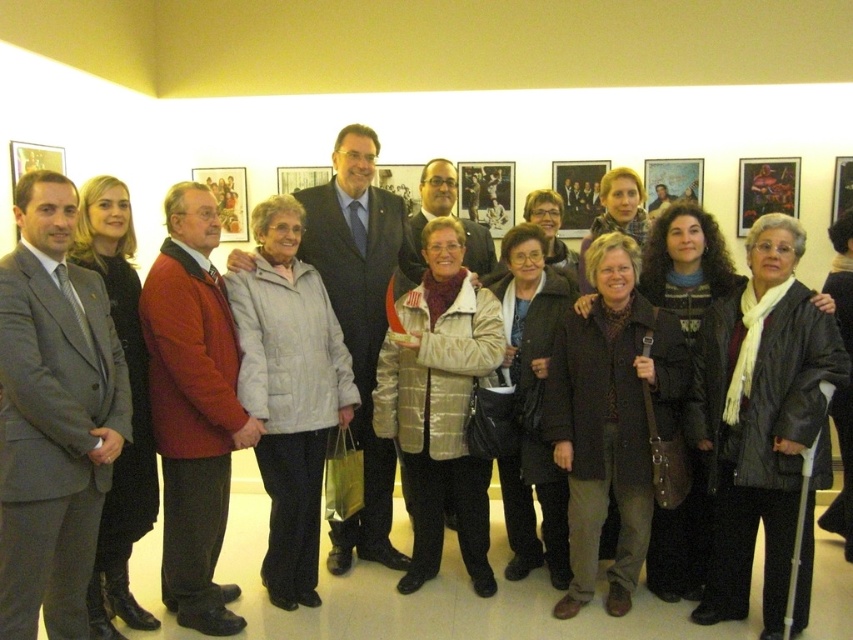
You are standing in the gallery and want to take a photo of the gray suit at left and the light gray quilted jacket at center. Which one is positioned higher in the image?

The gray suit at left is located above the light gray quilted jacket at center, so it is positioned higher in the image.

You are a photographer adjusting the camera settings to ensure all subjects are in focus. Given that the gray suit at left is shorter than the red woolen jacket at center, which subject should you adjust the focus for to accommodate both heights?

The gray suit at left is shorter than the red woolen jacket at center, so you should adjust the focus to ensure both the shorter gray suit at left and the taller red woolen jacket at center are in focus.